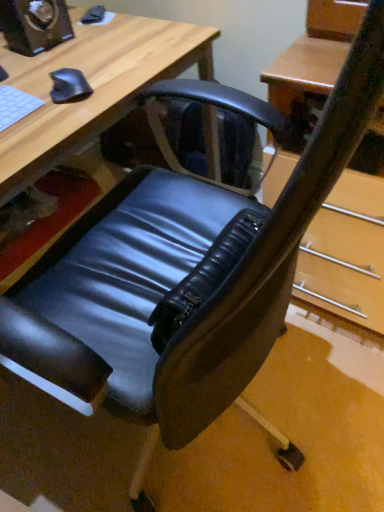
Question: Is matte black speaker at upper left inside the boundaries of black matte mouse at upper left, or outside?

Choices:
 (A) inside
 (B) outside

Answer: (B)

Question: Considering their positions, is matte black speaker at upper left located in front of or behind black matte mouse at upper left?

Choices:
 (A) behind
 (B) front

Answer: (A)

Question: Estimate the real-world distances between objects in this image. Which object is farther from the white matte keyboard at upper left?

Choices:
 (A) matte black speaker at upper left
 (B) matte black chair at lower left
 (C) black matte mouse at upper left

Answer: (A)

Question: Which object is positioned closest to the white matte keyboard at upper left?

Choices:
 (A) matte black speaker at upper left
 (B) black matte mouse at upper left
 (C) matte black chair at lower left

Answer: (B)